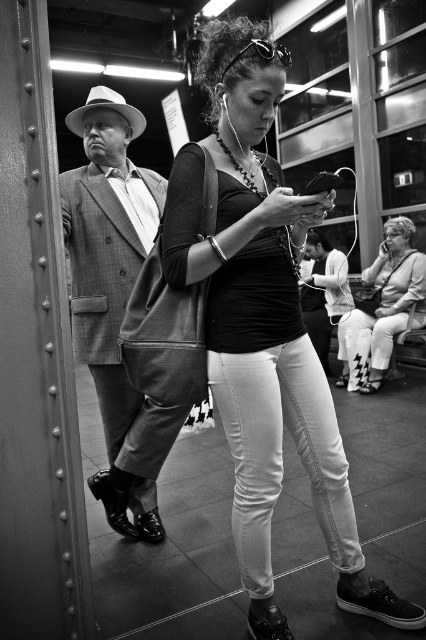
From the picture: Which is more to the right, matte black shirt at center or white textured pants at lower right?

From the viewer's perspective, white textured pants at lower right appears more on the right side.

Find the location of `matte black shirt at center`. matte black shirt at center is located at coordinates coord(264,326).

The height and width of the screenshot is (640, 426). Describe the element at coordinates (115, 296) in the screenshot. I see `plaid wool suit at left` at that location.

Can you confirm if plaid wool suit at left is positioned to the left of white textured pants at lower right?

Indeed, plaid wool suit at left is positioned on the left side of white textured pants at lower right.

Between point (111, 253) and point (340, 378), which one is positioned behind?

The point (340, 378) is more distant.

Image resolution: width=426 pixels, height=640 pixels. I want to click on plaid wool suit at left, so click(x=115, y=296).

Which of these two, matte black shirt at center or plaid wool suit at left, stands shorter?

With less height is plaid wool suit at left.

Which of these two, matte black shirt at center or plaid wool suit at left, stands taller?

Standing taller between the two is matte black shirt at center.

Find the location of a particular element. This screenshot has height=640, width=426. matte black shirt at center is located at coordinates (264, 326).